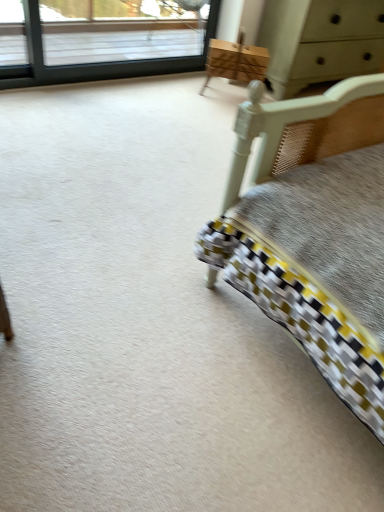
Question: Is light gray wood dresser at upper right to the right of wooden chest of drawers at upper center from the viewer's perspective?

Choices:
 (A) no
 (B) yes

Answer: (B)

Question: Can you confirm if light gray wood dresser at upper right is bigger than wooden chest of drawers at upper center?

Choices:
 (A) yes
 (B) no

Answer: (A)

Question: Is light gray wood dresser at upper right positioned in front of wooden chest of drawers at upper center?

Choices:
 (A) yes
 (B) no

Answer: (A)

Question: From the image's perspective, is light gray wood dresser at upper right beneath wooden chest of drawers at upper center?

Choices:
 (A) no
 (B) yes

Answer: (A)

Question: Is light gray wood dresser at upper right thinner than wooden chest of drawers at upper center?

Choices:
 (A) no
 (B) yes

Answer: (A)

Question: Considering the relative sizes of light gray wood dresser at upper right and wooden chest of drawers at upper center in the image provided, is light gray wood dresser at upper right smaller than wooden chest of drawers at upper center?

Choices:
 (A) yes
 (B) no

Answer: (B)

Question: From the image's perspective, is clear glass window at upper left over wooden chest of drawers at upper center?

Choices:
 (A) yes
 (B) no

Answer: (A)

Question: Are clear glass window at upper left and wooden chest of drawers at upper center far apart?

Choices:
 (A) no
 (B) yes

Answer: (A)

Question: Does clear glass window at upper left have a greater width compared to wooden chest of drawers at upper center?

Choices:
 (A) no
 (B) yes

Answer: (A)

Question: Can you confirm if clear glass window at upper left is smaller than wooden chest of drawers at upper center?

Choices:
 (A) yes
 (B) no

Answer: (B)

Question: Is clear glass window at upper left further to camera compared to wooden chest of drawers at upper center?

Choices:
 (A) no
 (B) yes

Answer: (A)

Question: Could you tell me if clear glass window at upper left is facing wooden chest of drawers at upper center?

Choices:
 (A) no
 (B) yes

Answer: (B)

Question: From a real-world perspective, is wooden chest of drawers at upper center physically above light gray wood dresser at upper right?

Choices:
 (A) no
 (B) yes

Answer: (A)